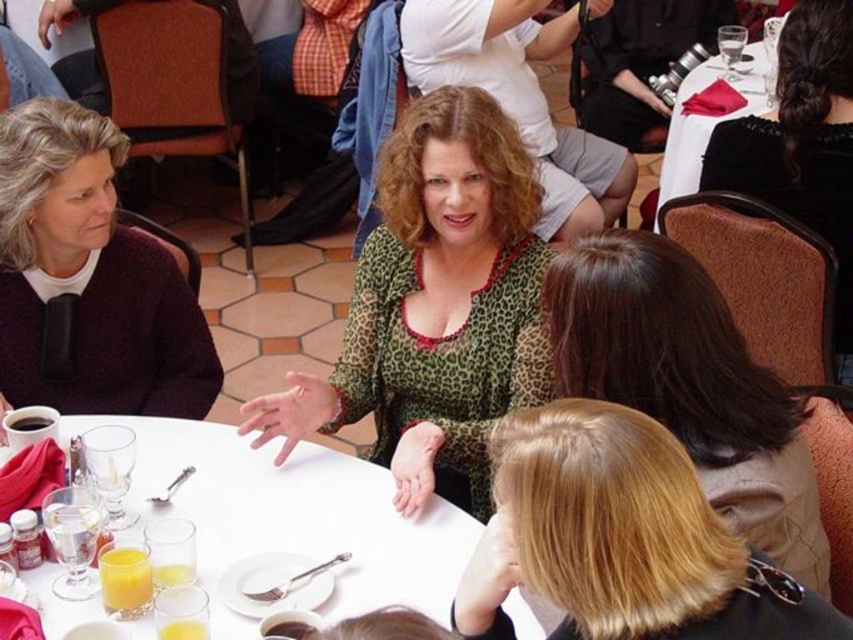
Question: Estimate the real-world distances between objects in this image. Which object is farther from the green leopard print blouse at center?

Choices:
 (A) blonde hair at center
 (B) white glossy table at center

Answer: (A)

Question: Is green leopard print blouse at center further to the viewer compared to black satin hair at upper right?

Choices:
 (A) no
 (B) yes

Answer: (A)

Question: Considering the real-world distances, which object is closest to the maroon sweater at left?

Choices:
 (A) translucent glass cup at lower left
 (B) black satin hair at upper right
 (C) blonde hair at center

Answer: (A)

Question: Is dark brown hair at upper center to the left of maroon sweater at left from the viewer's perspective?

Choices:
 (A) yes
 (B) no

Answer: (B)

Question: Which point appears closest to the camera in this image?

Choices:
 (A) (521, 627)
 (B) (140, 586)
 (C) (535, 580)

Answer: (C)

Question: Where is dark brown hair at upper center located in relation to black satin hair at upper right in the image?

Choices:
 (A) above
 (B) below

Answer: (B)